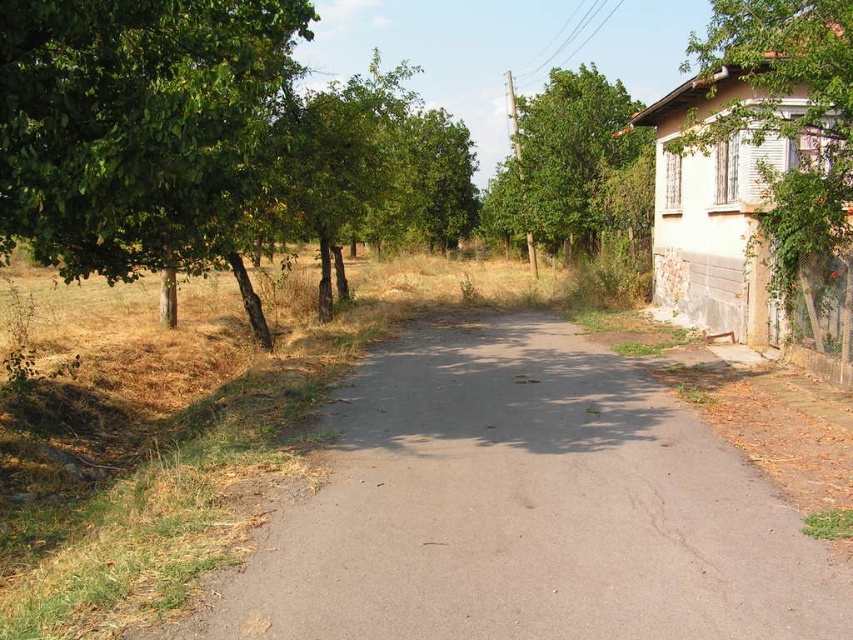
You are standing at point (x=131, y=74) and want to walk to the single story building on the right side of the road. Which direction should you go relative to point (x=202, y=616)?

You should walk towards point (x=202, y=616) because it is in front of your current position at point (x=131, y=74), so moving toward it will lead you closer to the single story building on the right side of the road.